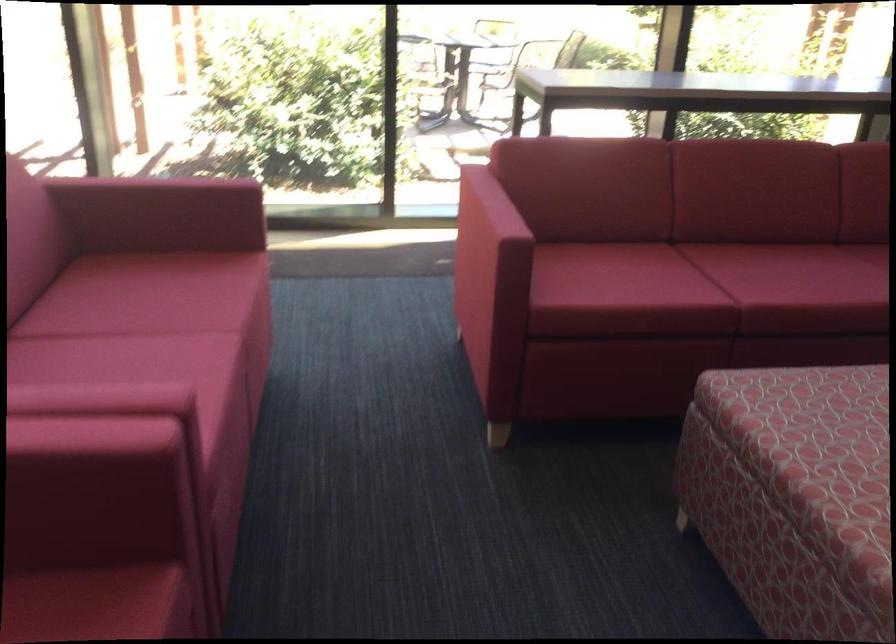
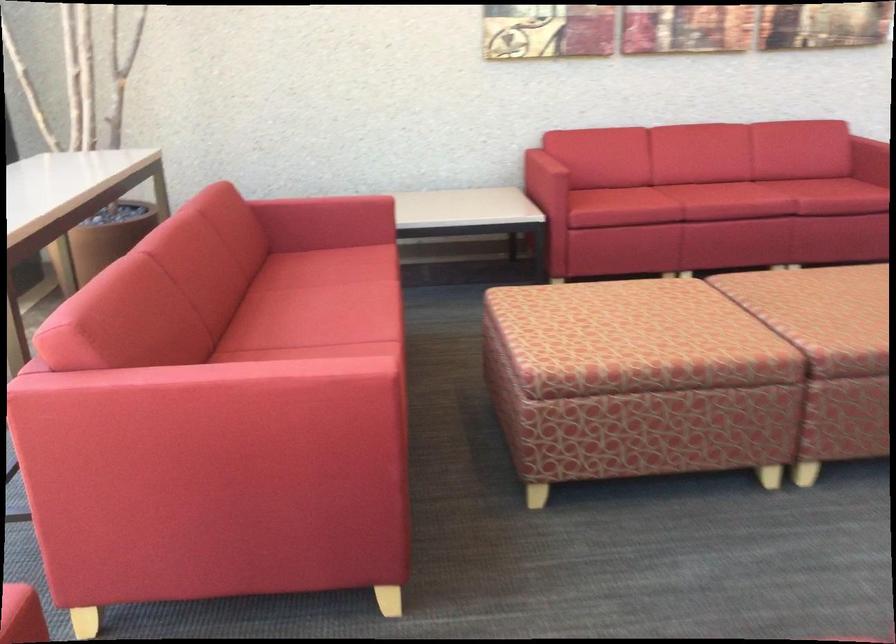
In the second image, find the point that corresponds to point (685, 274) in the first image.

(319, 355)